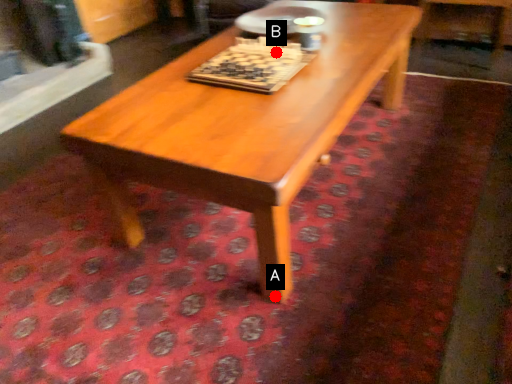
Question: Two points are circled on the image, labeled by A and B beside each circle. Which point is farther to the camera?

Choices:
 (A) A is further
 (B) B is further

Answer: (B)